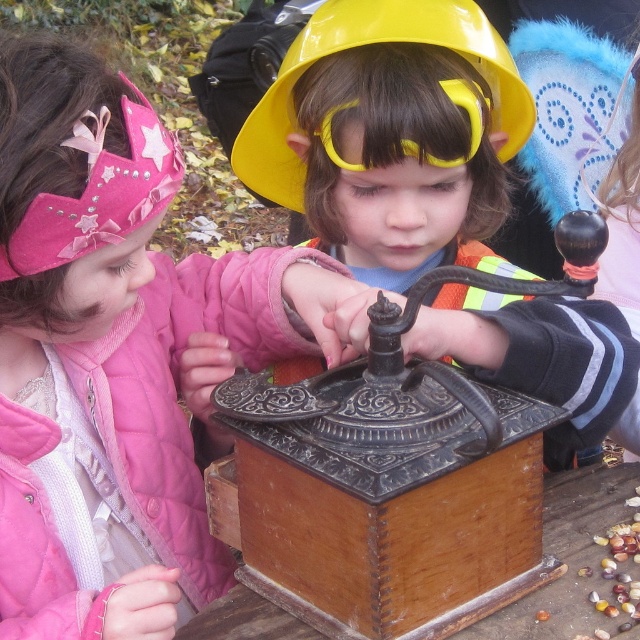
Question: Which of the following is the farthest from the observer?

Choices:
 (A) (244, 266)
 (B) (332, 508)

Answer: (A)

Question: Estimate the real-world distances between objects in this image. Which object is farther from the matte black grinder at center?

Choices:
 (A) pink quilted jacket at left
 (B) yellow matte safety goggles at center

Answer: (A)

Question: Considering the real-world distances, which object is farthest from the yellow matte safety goggles at center?

Choices:
 (A) matte black grinder at center
 (B) wooden box at center
 (C) yellow hard hat at center
 (D) pink quilted jacket at left

Answer: (B)

Question: Can you confirm if pink quilted jacket at left is smaller than yellow matte safety goggles at center?

Choices:
 (A) no
 (B) yes

Answer: (A)

Question: Does wooden box at center appear over yellow hard hat at center?

Choices:
 (A) yes
 (B) no

Answer: (B)

Question: Is pink quilted jacket at left positioned at the back of yellow hard hat at center?

Choices:
 (A) no
 (B) yes

Answer: (A)